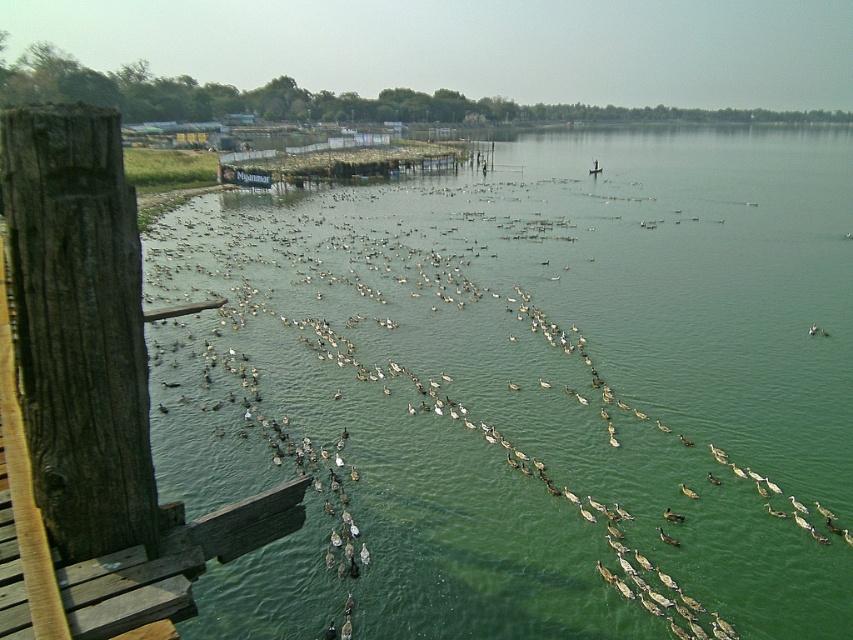
Question: Which point appears farthest from the camera in this image?

Choices:
 (A) (845, 392)
 (B) (122, 596)

Answer: (A)

Question: Which object appears closest to the camera in this image?

Choices:
 (A) wooden planks at lower left
 (B) green water at center

Answer: (A)

Question: Can you confirm if green water at center is thinner than wooden planks at lower left?

Choices:
 (A) no
 (B) yes

Answer: (A)

Question: Can you confirm if green water at center is positioned to the right of wooden planks at lower left?

Choices:
 (A) yes
 (B) no

Answer: (A)

Question: From the image, what is the correct spatial relationship of green water at center in relation to wooden planks at lower left?

Choices:
 (A) left
 (B) right

Answer: (B)